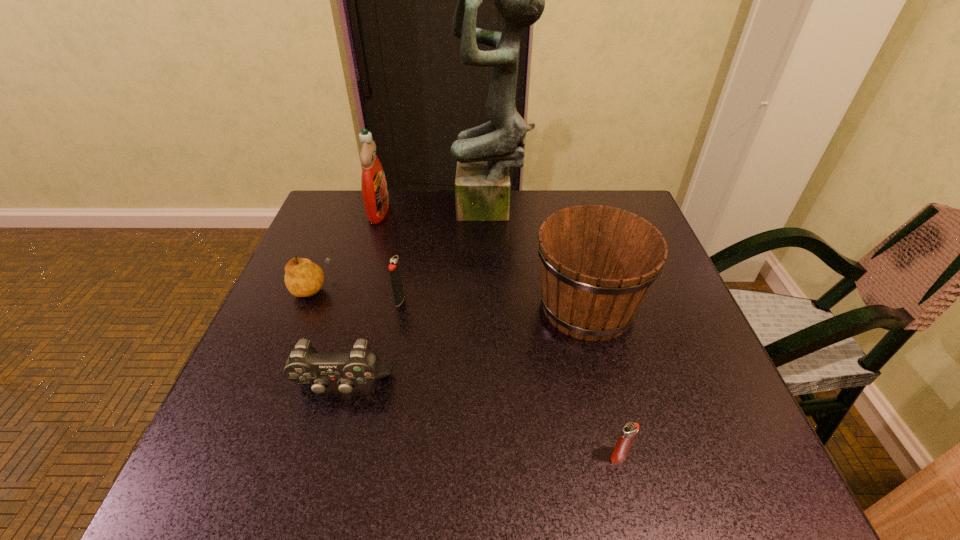
Locate an element on the screen. The width and height of the screenshot is (960, 540). the tallest object is located at coordinates (484, 154).

Identify the location of the sixth shortest object. (375, 196).

This screenshot has height=540, width=960. I want to click on the third tallest object, so pos(598,263).

Find the location of `the farther igniter`. the farther igniter is located at coordinates (394, 268).

Locate an element on the screen. The height and width of the screenshot is (540, 960). the taller igniter is located at coordinates (394, 268).

Where is `control`? This screenshot has width=960, height=540. control is located at coordinates (305, 365).

Identify the location of pear. (303, 278).

Identify the location of the shorter igniter. (629, 431).

Locate an element on the screen. the right igniter is located at coordinates (629, 431).

Identify the location of vacant space located on the face of the tallest object. This screenshot has width=960, height=540. (387, 211).